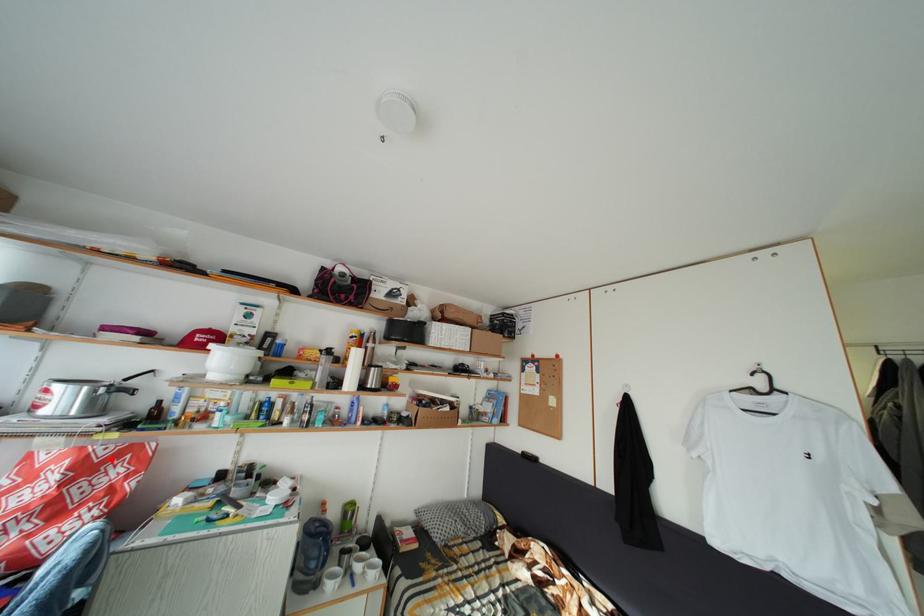
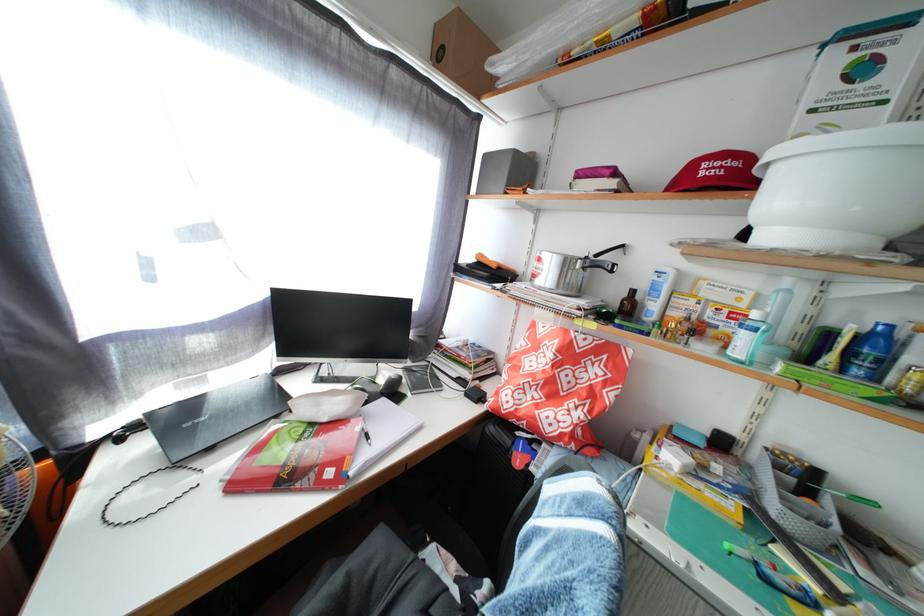
The point at the highlighted location is marked in the first image. Where is the corresponding point in the second image?

(590, 350)